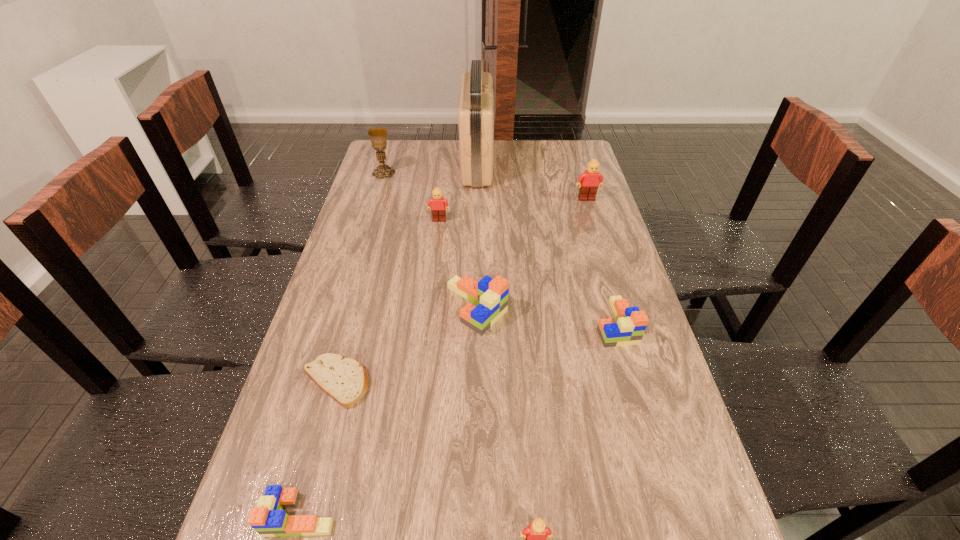
In the image, there is a desktop. Where is `vacant region at the far left corner`? vacant region at the far left corner is located at coordinates (411, 154).

Identify the location of vacant region at the far right corner. This screenshot has height=540, width=960. (573, 143).

Locate an element on the screen. free spot between the pita bread and the leftmost brown Lego is located at coordinates (388, 301).

Locate an element on the screen. The width and height of the screenshot is (960, 540). free space between the radio receiver and the gold chalice is located at coordinates (430, 168).

Find the location of `vacant space that's between the eighth tallest object and the seventh farthest object`. vacant space that's between the eighth tallest object and the seventh farthest object is located at coordinates (319, 448).

Locate an element on the screen. unoccupied position between the rightmost orange Lego and the second orange Lego from right to left is located at coordinates (545, 315).

This screenshot has height=540, width=960. I want to click on free space between the biggest orange Lego and the biggest brown Lego, so click(532, 253).

Identify which object is located as the third nearest to the second biggest orange Lego. Please provide its 2D coordinates. Your answer should be formatted as a tuple, i.e. [(x, y)], where the tuple contains the x and y coordinates of a point satisfying the conditions above.

[(589, 181)]

Find the location of a particular element. object that is the second closest to the chalice is located at coordinates (438, 210).

Locate an element on the screen. The image size is (960, 540). Lego that stands as the second closest to the second biggest brown Lego is located at coordinates (589, 181).